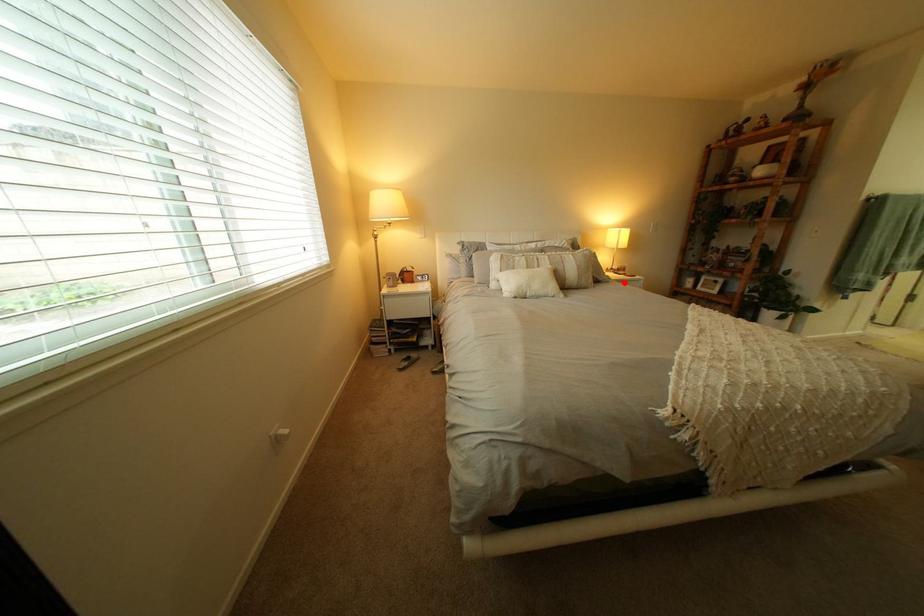
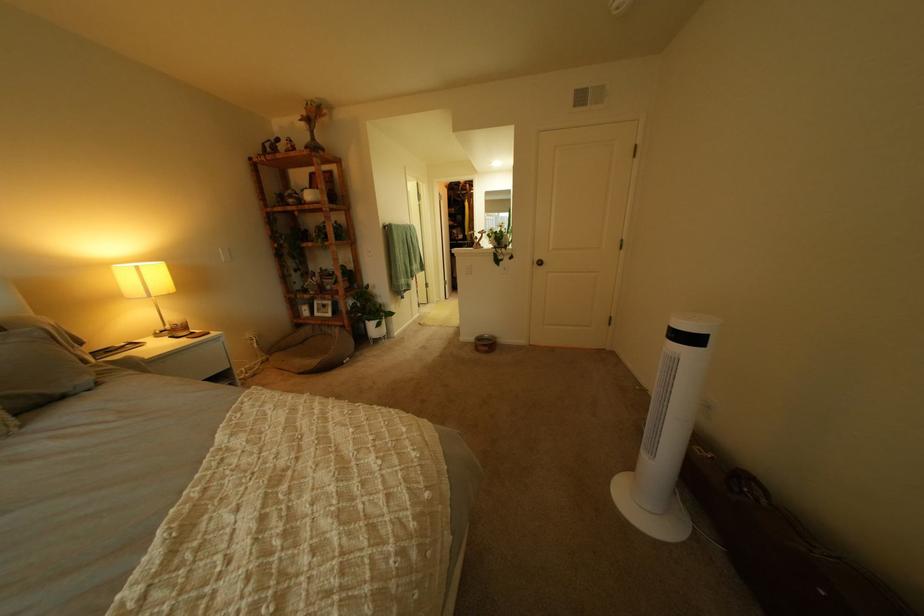
The point at the highlighted location is marked in the first image. Where is the corresponding point in the second image?

(115, 385)